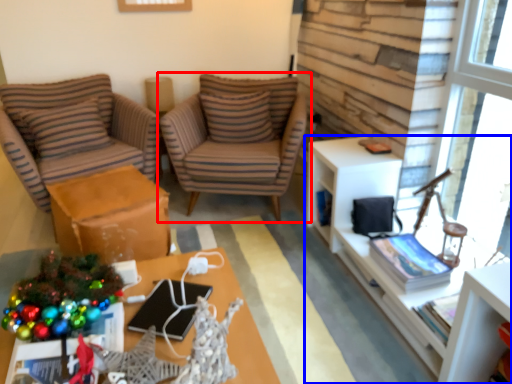
Question: Which object is closer to the camera taking this photo, chair (highlighted by a red box) or cabinetry (highlighted by a blue box)?

Choices:
 (A) chair
 (B) cabinetry

Answer: (B)